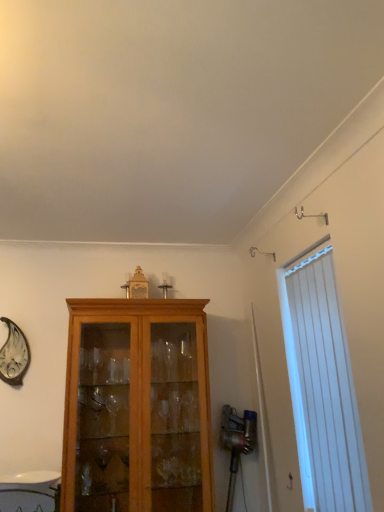
Question: Considering the relative sizes of white vertical blinds at right and light brown wood cabinet at center in the image provided, is white vertical blinds at right bigger than light brown wood cabinet at center?

Choices:
 (A) yes
 (B) no

Answer: (B)

Question: From the image's perspective, is white vertical blinds at right located beneath light brown wood cabinet at center?

Choices:
 (A) no
 (B) yes

Answer: (A)

Question: Is white vertical blinds at right smaller than light brown wood cabinet at center?

Choices:
 (A) yes
 (B) no

Answer: (A)

Question: Is white vertical blinds at right positioned with its back to light brown wood cabinet at center?

Choices:
 (A) no
 (B) yes

Answer: (A)

Question: Is white vertical blinds at right positioned behind light brown wood cabinet at center?

Choices:
 (A) no
 (B) yes

Answer: (A)

Question: Is white vertical blinds at right taller than light brown wood cabinet at center?

Choices:
 (A) no
 (B) yes

Answer: (A)

Question: Is light brown wood cabinet at center bigger than white vertical blinds at right?

Choices:
 (A) no
 (B) yes

Answer: (B)

Question: Does light brown wood cabinet at center have a lesser width compared to white vertical blinds at right?

Choices:
 (A) no
 (B) yes

Answer: (A)

Question: Does light brown wood cabinet at center have a greater width compared to white vertical blinds at right?

Choices:
 (A) no
 (B) yes

Answer: (B)

Question: Is light brown wood cabinet at center not near white vertical blinds at right?

Choices:
 (A) no
 (B) yes

Answer: (A)

Question: Is light brown wood cabinet at center turned away from white vertical blinds at right?

Choices:
 (A) no
 (B) yes

Answer: (A)

Question: Is light brown wood cabinet at center with white vertical blinds at right?

Choices:
 (A) no
 (B) yes

Answer: (A)

Question: In the image, is white vertical blinds at right on the left side or the right side of light brown wood cabinet at center?

Choices:
 (A) right
 (B) left

Answer: (A)